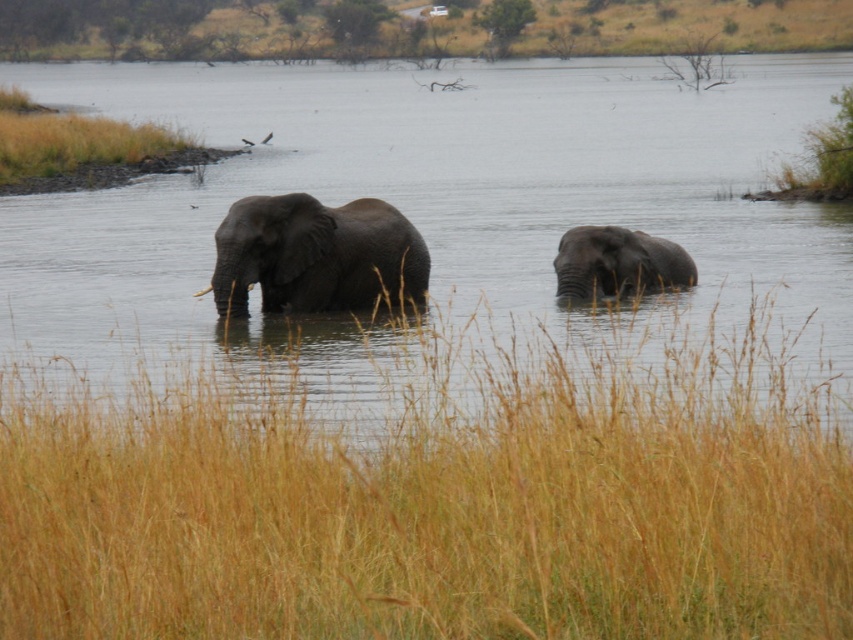
You are standing on the bank of the river and see the two elephants. Which elephant, the gray matte elephant at center or the gray matte elephant at right, is closer to you?

The gray matte elephant at center is closer to you because it is positioned in front of the gray matte elephant at right.